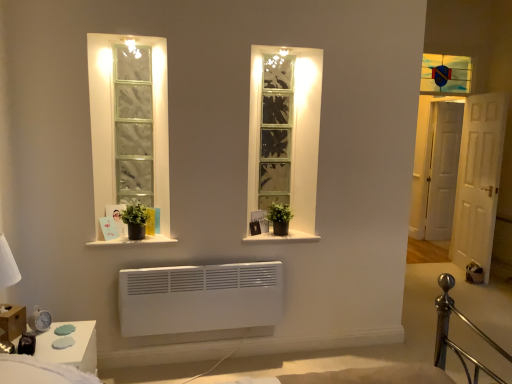
You are a GUI agent. You are given a task and a screenshot of the screen. Output one action in this format:
    pyautogui.click(x=<x>, y=<y>)
    Task: Click on the free location above clear glass window at center (from a real-world perspective)
    
    Given the screenshot: What is the action you would take?
    pyautogui.click(x=275, y=60)